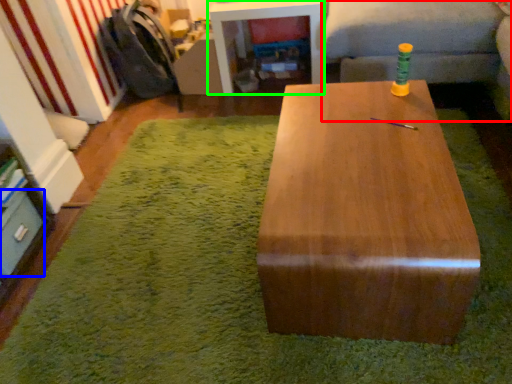
Question: Which object is positioned closest to couch (highlighted by a red box)? Select from drawer (highlighted by a blue box) and table (highlighted by a green box).

Choices:
 (A) drawer
 (B) table

Answer: (B)